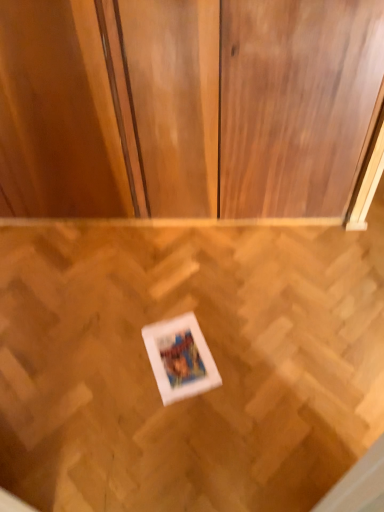
Question: Is wooden parquet floor at center bigger than matte wood dresser at center?

Choices:
 (A) yes
 (B) no

Answer: (B)

Question: Could you tell me if wooden parquet floor at center is facing matte wood dresser at center?

Choices:
 (A) yes
 (B) no

Answer: (B)

Question: Does wooden parquet floor at center lie behind matte wood dresser at center?

Choices:
 (A) no
 (B) yes

Answer: (A)

Question: Are wooden parquet floor at center and matte wood dresser at center located far from each other?

Choices:
 (A) yes
 (B) no

Answer: (B)

Question: Is wooden parquet floor at center facing away from matte wood dresser at center?

Choices:
 (A) no
 (B) yes

Answer: (A)

Question: From a real-world perspective, is wooden parquet floor at center above or below matte wood dresser at center?

Choices:
 (A) below
 (B) above

Answer: (A)

Question: In terms of size, does wooden parquet floor at center appear bigger or smaller than matte wood dresser at center?

Choices:
 (A) small
 (B) big

Answer: (A)

Question: Is wooden parquet floor at center taller or shorter than matte wood dresser at center?

Choices:
 (A) short
 (B) tall

Answer: (A)

Question: Is wooden parquet floor at center wider or thinner than matte wood dresser at center?

Choices:
 (A) wide
 (B) thin

Answer: (A)

Question: Considering the positions of white matte picture frame at center and matte wood dresser at center in the image, is white matte picture frame at center wider or thinner than matte wood dresser at center?

Choices:
 (A) thin
 (B) wide

Answer: (B)

Question: From the image's perspective, is white matte picture frame at center positioned above or below matte wood dresser at center?

Choices:
 (A) below
 (B) above

Answer: (A)

Question: Is point (195, 361) closer or farther from the camera than point (71, 185)?

Choices:
 (A) closer
 (B) farther

Answer: (A)

Question: Is white matte picture frame at center to the left or to the right of matte wood dresser at center in the image?

Choices:
 (A) left
 (B) right

Answer: (B)

Question: From the image's perspective, is matte wood dresser at center positioned above or below wooden parquet floor at center?

Choices:
 (A) below
 (B) above

Answer: (B)

Question: Choose the correct answer: Is matte wood dresser at center inside wooden parquet floor at center or outside it?

Choices:
 (A) inside
 (B) outside

Answer: (B)